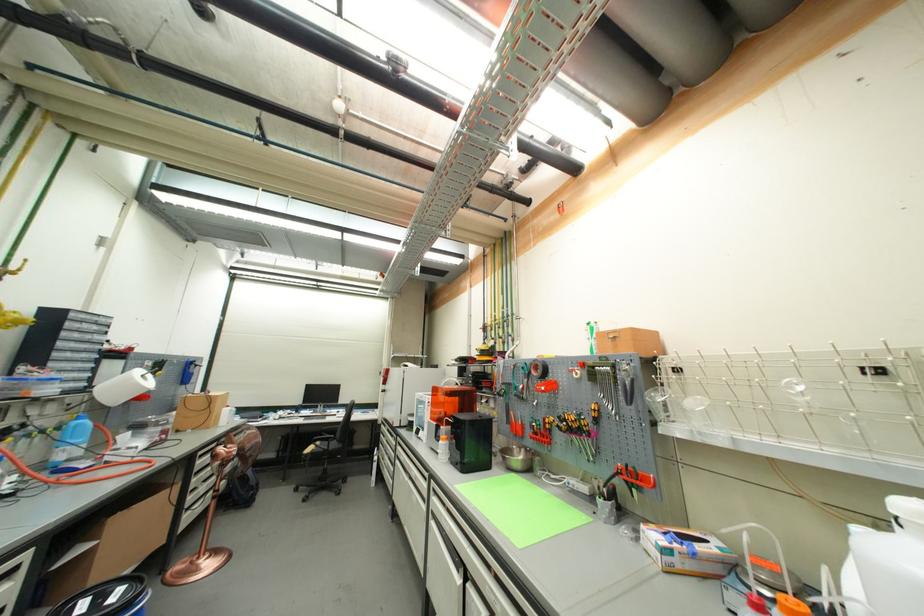
This screenshot has width=924, height=616. What do you see at coordinates (569, 424) in the screenshot?
I see `the red pliers handle` at bounding box center [569, 424].